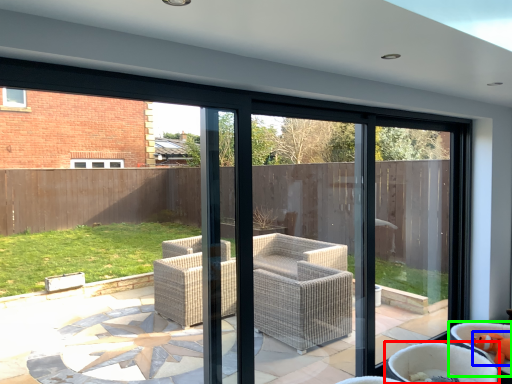
Question: Which is farther away from chair (highlighted by a red box)? toy (highlighted by a blue box) or chair (highlighted by a green box)?

Choices:
 (A) toy
 (B) chair

Answer: (A)